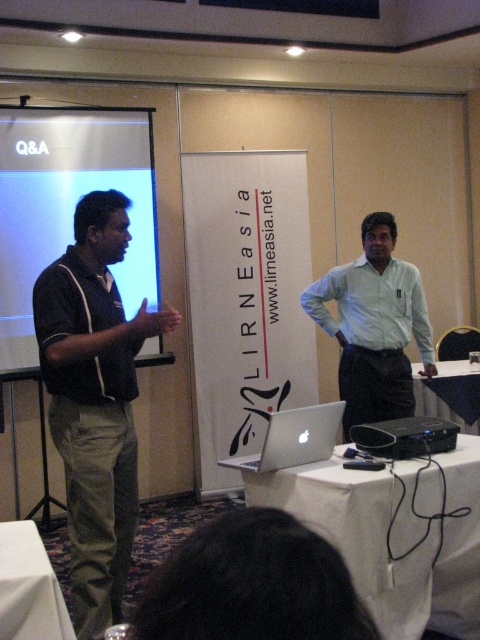
You are standing at the entrance of the conference room and see two points marked on the wall. The first point is at coordinates point [290,433] and the second point is at point [416,436]. Which point is closer to you as you face the wall?

Point [290,433] is in front of point [416,436], so it is closer to you as you face the wall.

You are setting up a presentation and need to position your projector correctly. Where is the white glossy projection screen at upper left located in the room?

The white glossy projection screen at upper left is located at point 0.322 on the x axis and 0.144 on the y axis.

You are an event organizer setting up for a presentation. You need to adjust the projector to ensure the image is visible on the white glossy projection screen at upper left and the silver metallic laptop at center. Which object should you focus on first to align the projector correctly?

You should focus on the white glossy projection screen at upper left first because it is closer to the viewer than the silver metallic laptop at center, so aligning the projector to it ensures the image is properly projected before adjusting for the laptop.